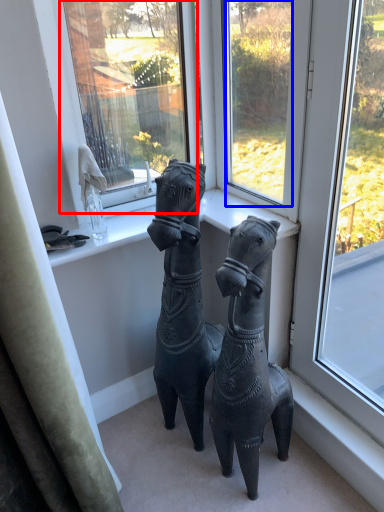
Question: Which object is further to the camera taking this photo, window screen (highlighted by a red box) or window (highlighted by a blue box)?

Choices:
 (A) window screen
 (B) window

Answer: (A)